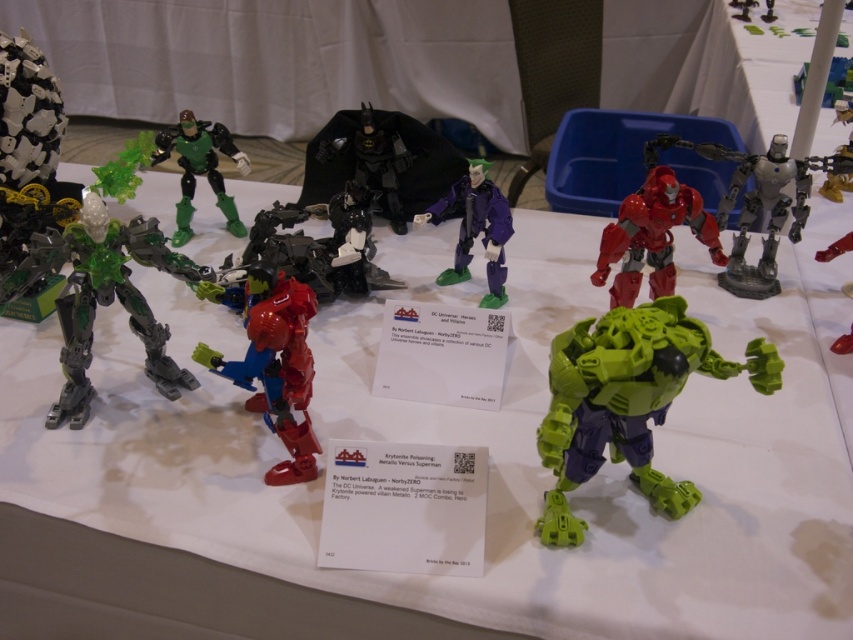
Question: Which point is farther from the camera taking this photo?

Choices:
 (A) (698, 227)
 (B) (781, 163)

Answer: (B)

Question: Is green matte hulk at center to the right of shiny red robot at center from the viewer's perspective?

Choices:
 (A) no
 (B) yes

Answer: (A)

Question: Estimate the real-world distances between objects in this image. Which object is closer to the purple matte figure at center?

Choices:
 (A) green matte hulk at center
 (B) green matte figure at upper left
 (C) green metallic robot at left
 (D) shiny red plastic robot at center

Answer: (D)

Question: Is shiny red robot at center thinner than metallic silver robot at right?

Choices:
 (A) yes
 (B) no

Answer: (B)

Question: Can you confirm if green matte figure at upper left is positioned below matte black batman at center?

Choices:
 (A) yes
 (B) no

Answer: (A)

Question: Which of the following is the closest to the observer?

Choices:
 (A) (724, 285)
 (B) (183, 369)

Answer: (B)